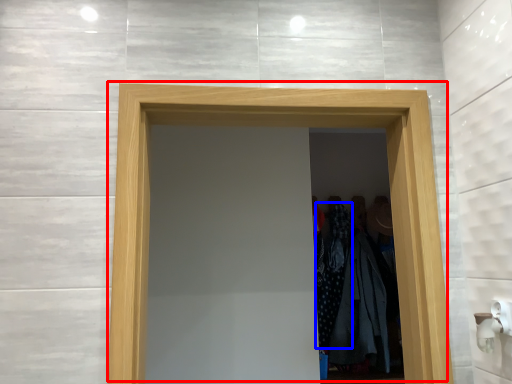
Question: Which point is further to the camera, door (highlighted by a red box) or clothing (highlighted by a blue box)?

Choices:
 (A) door
 (B) clothing

Answer: (B)